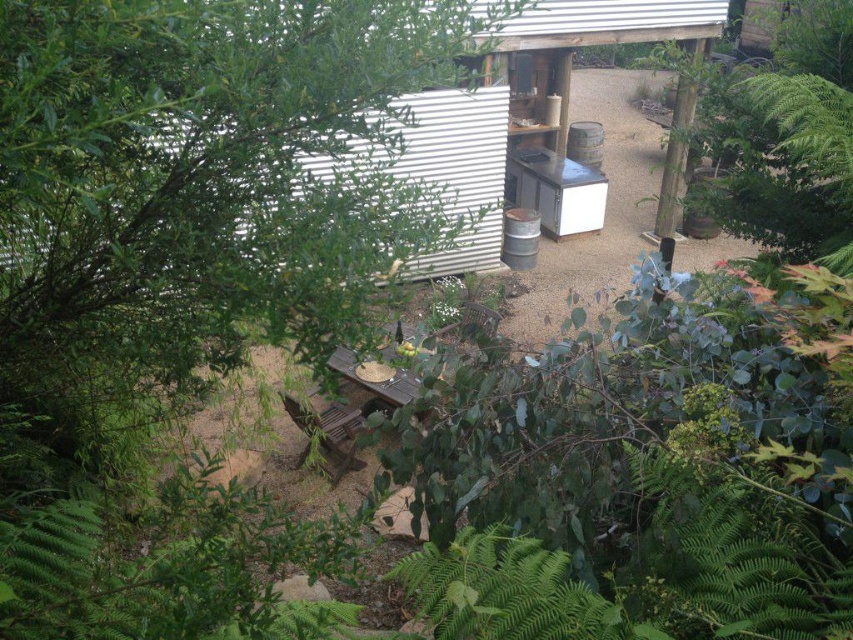
Question: Is metallic corrugated hut at upper center further to camera compared to brown wooden picnic table at center?

Choices:
 (A) yes
 (B) no

Answer: (A)

Question: Does metallic corrugated hut at upper center appear on the left side of brown wooden picnic table at center?

Choices:
 (A) yes
 (B) no

Answer: (B)

Question: Which point is farther from the camera taking this photo?

Choices:
 (A) (424, 170)
 (B) (341, 404)

Answer: (A)

Question: Among these points, which one is farthest from the camera?

Choices:
 (A) (328, 362)
 (B) (582, 28)

Answer: (B)

Question: Is metallic corrugated hut at upper center positioned at the back of brown wooden picnic table at center?

Choices:
 (A) yes
 (B) no

Answer: (A)